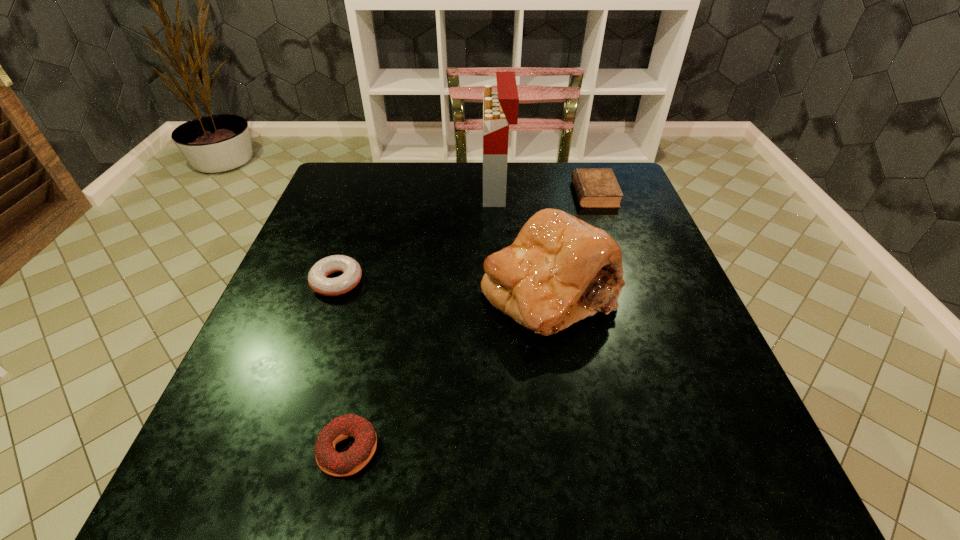
Locate an element on the screen. This screenshot has width=960, height=540. vacant position located on the filling side of the fourth shortest object is located at coordinates (582, 489).

Identify the location of free space located 0.140m on the back of the farther doughnut. The image size is (960, 540). (356, 227).

Find the location of a particular element. free spot located on the spine side of the diary is located at coordinates (431, 194).

Locate an element on the screen. vacant space located 0.160m on the spine side of the diary is located at coordinates (516, 194).

Where is `vacant space situated 0.250m on the spine side of the diary`? vacant space situated 0.250m on the spine side of the diary is located at coordinates (482, 194).

At what (x,y) coordinates should I click in order to perform the action: click on vacant space located 0.230m on the back of the fourth object from right to left. Please return your answer as a coordinate pair (x, y). This screenshot has height=540, width=960. Looking at the image, I should click on (378, 315).

Identify the location of cigarette case that is at the far edge. This screenshot has width=960, height=540. (500, 108).

At what (x,y) coordinates should I click in order to perform the action: click on diary that is at the far edge. Please return your answer as a coordinate pair (x, y). Image resolution: width=960 pixels, height=540 pixels. Looking at the image, I should click on (x=595, y=187).

Where is `object present at the near edge`? This screenshot has width=960, height=540. object present at the near edge is located at coordinates (349, 462).

Where is `object that is at the left edge`? Image resolution: width=960 pixels, height=540 pixels. object that is at the left edge is located at coordinates (317, 277).